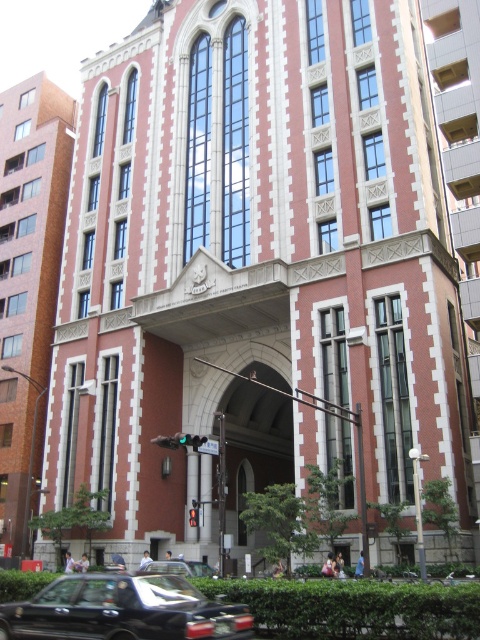
You are standing at the center of the image and want to locate the point at coordinates (122, 611). Based on the scene description, which object is this point located on?

The point at coordinates (122, 611) is located on the shiny black car at lower left.

You are a delivery person who needs to park your vehicle in a tight space between the shiny black car at lower left and the black glossy car at center. Considering their heights, which car should you avoid parking next to if you have a tall delivery van?

You should avoid parking next to the shiny black car at lower left because it is much taller than the black glossy car at center, which could pose a risk of collision or obstruction for your tall delivery van.

You are a delivery driver who needs to park your vehicle in the area shown. You have two cars available for this task. One is a shiny black car at lower left and the other is a black glossy car at center. Given that the parking space here is only 5 meters long, which car would you choose to park and why?

The shiny black car at lower left is larger in size than the black glossy car at center. Therefore, the black glossy car at center is smaller and more suitable for the 5 meter parking space.